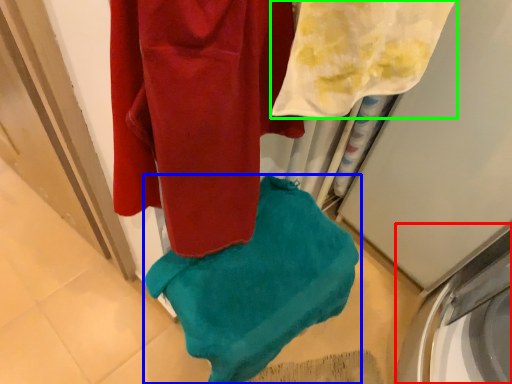
Question: Considering the real-world distances, which object is closest to washing machine (highlighted by a red box)? towel (highlighted by a blue box) or towel (highlighted by a green box).

Choices:
 (A) towel
 (B) towel

Answer: (A)